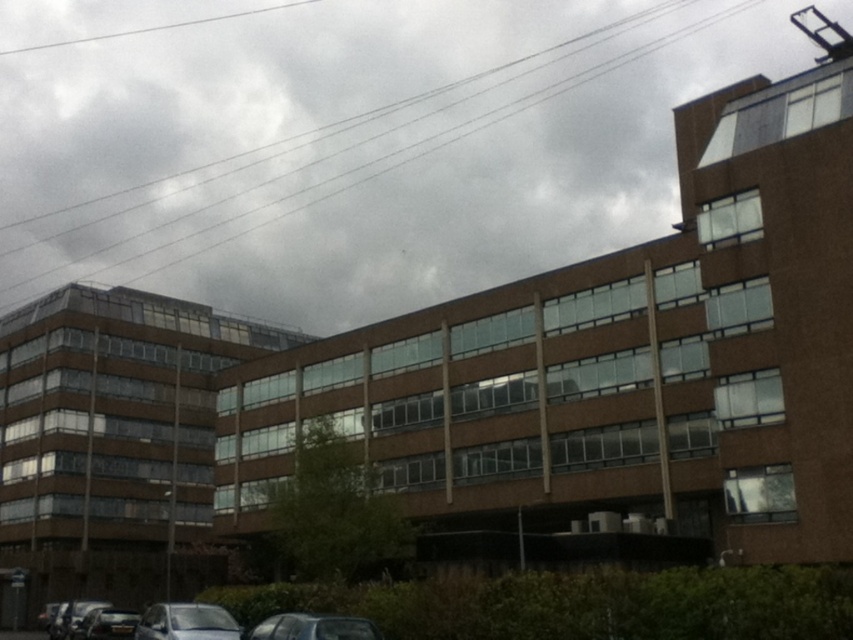
Who is shorter, metallic silver car at lower left or shiny silver car at lower left?

shiny silver car at lower left

Does metallic silver car at lower left have a lesser height compared to shiny silver car at lower left?

No, metallic silver car at lower left is not shorter than shiny silver car at lower left.

Find the location of a particular element. metallic silver car at lower left is located at coordinates coord(186,621).

Find the location of a particular element. metallic silver car at lower left is located at coordinates (186, 621).

Who is positioned more to the left, metallic silver car at lower left or metallic silver car at lower center?

metallic silver car at lower left is more to the left.

Who is taller, metallic silver car at lower left or metallic silver car at lower center?

metallic silver car at lower left is taller.

Identify the location of metallic silver car at lower left. (186, 621).

Can you confirm if metallic silver car at lower center is shorter than shiny silver car at lower left?

No, metallic silver car at lower center is not shorter than shiny silver car at lower left.

Does metallic silver car at lower center have a larger size compared to shiny silver car at lower left?

Indeed, metallic silver car at lower center has a larger size compared to shiny silver car at lower left.

Identify the location of metallic silver car at lower center. (312, 627).